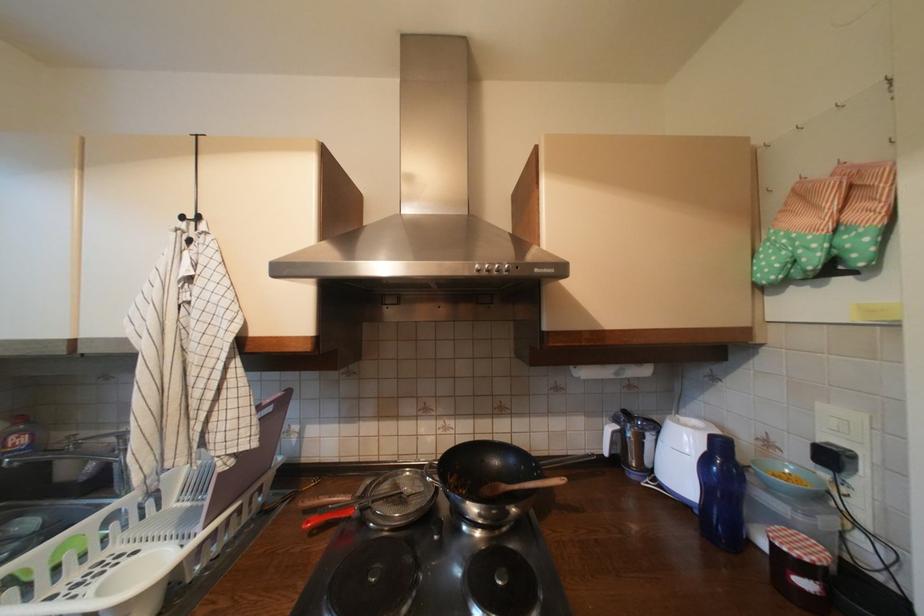
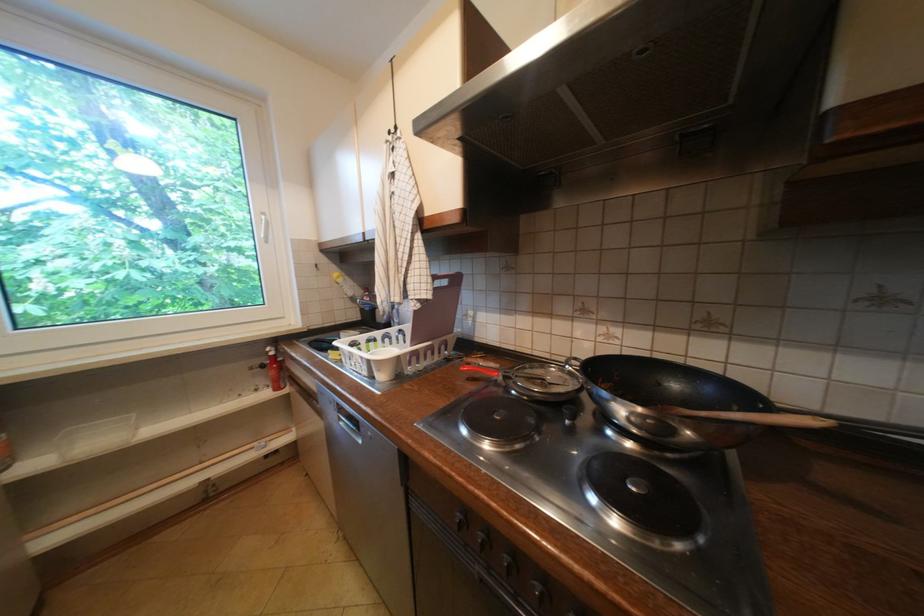
Question: How did the camera likely rotate?

Choices:
 (A) Left
 (B) Right
 (C) Up
 (D) Down

Answer: (A)